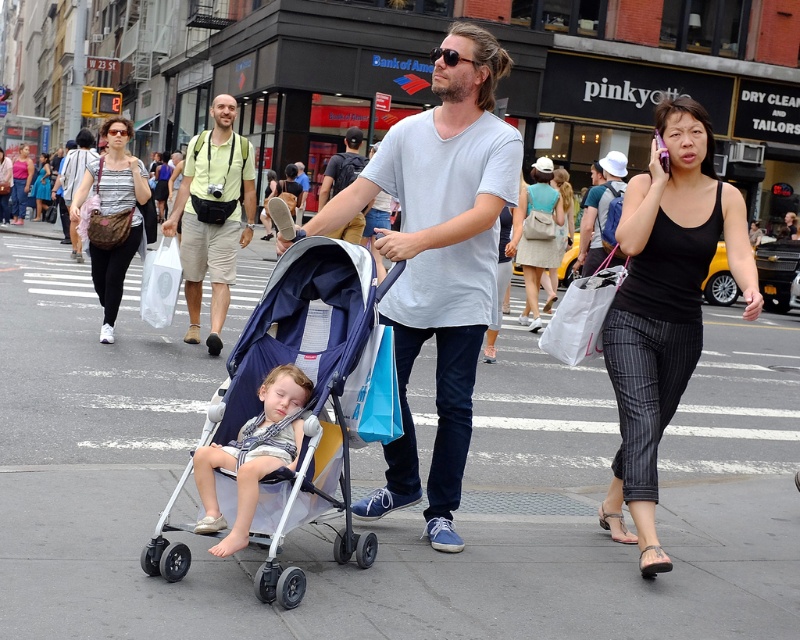
You are a delivery person who needs to place a large package on the ground. You see the gray asphalt at center and the light brown fabric stroller at center. Which surface can accommodate the package without it being obstructed by the stroller?

The gray asphalt at center has a larger size compared to the light brown fabric stroller at center, so the package can be placed on the gray asphalt at center without obstruction.